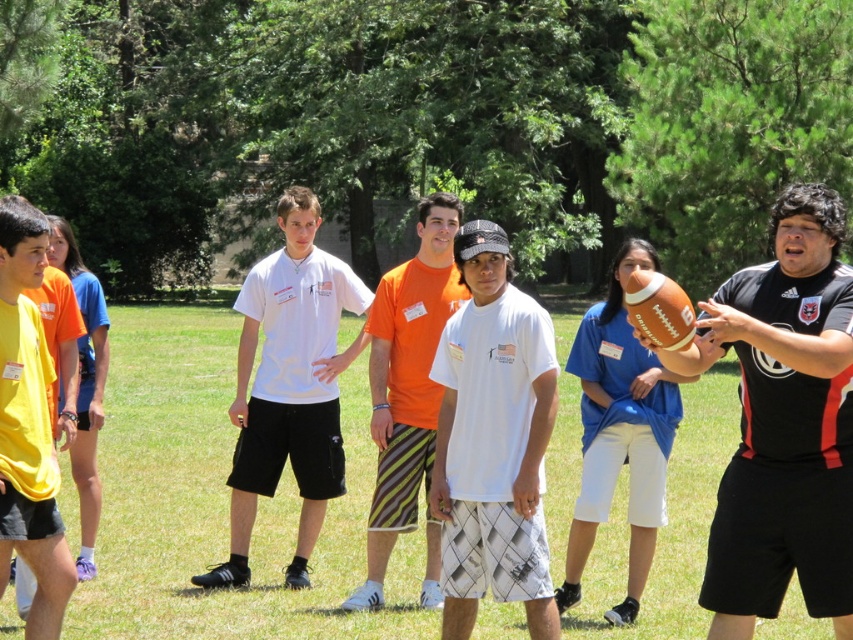
Find the location of `black matte jersey at right`. black matte jersey at right is located at coordinates (782, 422).

Can you confirm if black matte jersey at right is positioned below white textured shirt at center?

No, black matte jersey at right is not below white textured shirt at center.

The image size is (853, 640). What do you see at coordinates (782, 422) in the screenshot?
I see `black matte jersey at right` at bounding box center [782, 422].

Image resolution: width=853 pixels, height=640 pixels. I want to click on black matte jersey at right, so click(782, 422).

Find the location of a particular element. black matte jersey at right is located at coordinates (782, 422).

Does point (814, 564) come in front of point (41, 449)?

Yes, it is in front of point (41, 449).

Is point (846, 353) closer to viewer compared to point (15, 321)?

Yes.

I want to click on black matte jersey at right, so click(782, 422).

Can you confirm if black matte jersey at right is positioned to the right of orange striped shorts at center?

Correct, you'll find black matte jersey at right to the right of orange striped shorts at center.

Which is more to the left, black matte jersey at right or orange striped shorts at center?

orange striped shorts at center is more to the left.

Between point (762, 529) and point (399, 440), which one is positioned behind?

Positioned behind is point (399, 440).

You are a GUI agent. You are given a task and a screenshot of the screen. Output one action in this format:
    pyautogui.click(x=<x>, y=<y>)
    Task: Click on the black matte jersey at right
    
    Given the screenshot: What is the action you would take?
    pos(782,422)